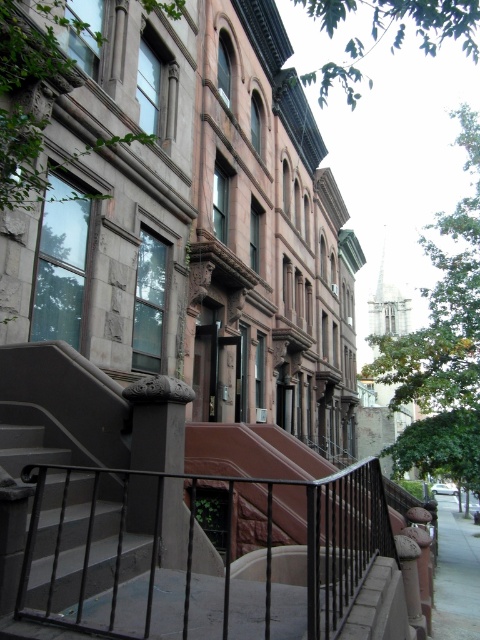
Can you confirm if black wrought iron at lower center is positioned to the left of dark gray concrete stairs at lower left?

In fact, black wrought iron at lower center is to the right of dark gray concrete stairs at lower left.

The image size is (480, 640). What do you see at coordinates (193, 556) in the screenshot?
I see `black wrought iron at lower center` at bounding box center [193, 556].

This screenshot has width=480, height=640. What are the coordinates of `black wrought iron at lower center` in the screenshot? It's located at (193, 556).

Is point (6, 445) farther from camera compared to point (434, 576)?

No, (6, 445) is closer to viewer.

Between dark gray concrete stairs at lower left and gray concrete sidewalk at lower right, which one appears on the left side from the viewer's perspective?

From the viewer's perspective, dark gray concrete stairs at lower left appears more on the left side.

The width and height of the screenshot is (480, 640). What are the coordinates of `dark gray concrete stairs at lower left` in the screenshot? It's located at (72, 540).

Does black wrought iron at lower center appear under gray concrete sidewalk at lower right?

No.

Who is more forward, (180, 480) or (457, 625)?

Point (180, 480) is in front.

Find the location of a particular element. The image size is (480, 640). black wrought iron at lower center is located at coordinates (193, 556).